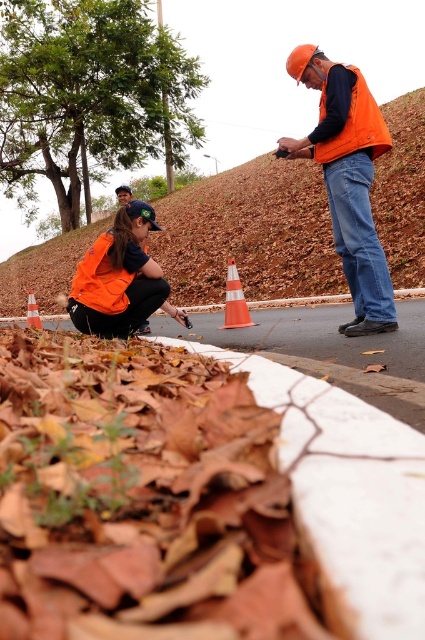
You are a pedestrian who wants to cross the road safely. You see an orange matte safety vest at lower left and an orange reflective cone at center. Which object is nearer to you?

The orange matte safety vest at lower left is closer to the viewer than the orange reflective cone at center, so the orange matte safety vest at lower left is nearer to you.

You are a pedestrian trying to cross the road where the two orange cones are placed. The orange reflective cone at center is blocking your path. Can you walk around it by stepping on the orange plastic traffic cone at lower left?

The orange reflective cone at center is positioned over the orange plastic traffic cone at lower left, so stepping on the orange plastic traffic cone at lower left might not be safe as it is under the reflective cone. Find another path to cross safely.

You are a delivery driver who needs to navigate through the area shown in the image. There is an orange reflective cone at center. Based on its position, can you determine if it marks a potential hazard or a safe path? Please explain your reasoning.

The orange reflective cone at center is typically used to mark hazards or obstacles on roads. Since it is placed at the center of the image, it likely indicates a hazard that drivers should avoid. Therefore, the area around the orange reflective cone at center is probably unsafe for navigation.